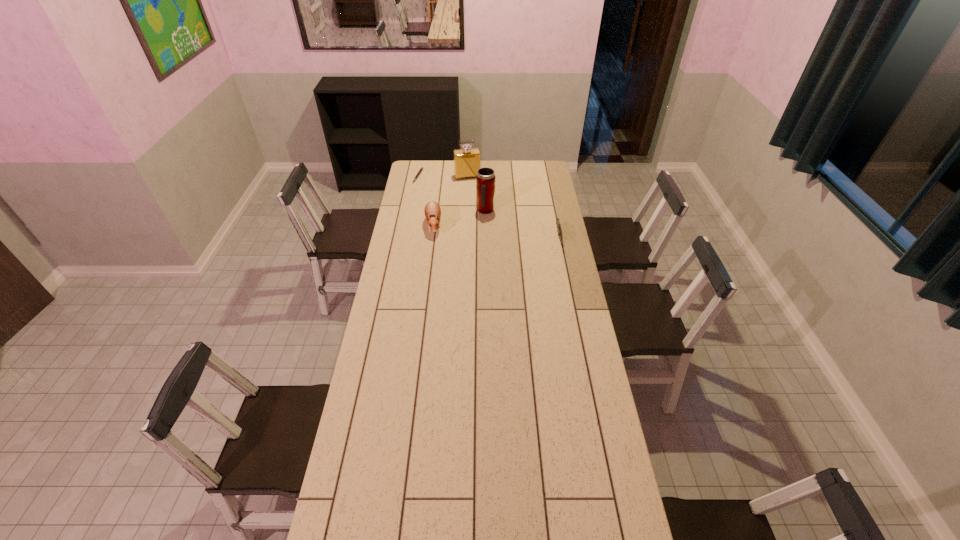
Identify the location of free space on the desktop that is between the third tallest object and the gun and is positioned on the front-facing side of the perfume. (483, 230).

The image size is (960, 540). Find the location of `free space on the desktop that is between the hamster and the rightmost object and is positioned at the nib of the leftmost object`. free space on the desktop that is between the hamster and the rightmost object and is positioned at the nib of the leftmost object is located at coordinates (510, 233).

This screenshot has width=960, height=540. I want to click on free spot on the desktop that is between the hamster and the gun and is positioned on the side with the handle of the thermos bottle, so click(x=509, y=233).